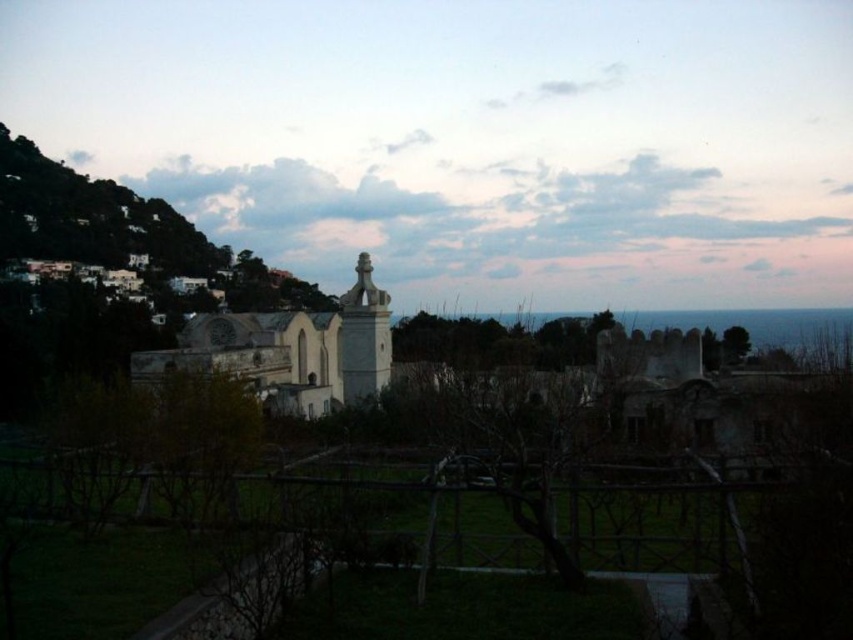
You are standing in the garden and want to take a photo of the white stone statue at center without the white stone church at center appearing in the background. Is this possible?

The white stone church at center is behind the white stone statue at center, so if you position yourself so that the statue is between you and the church, you can take a photo of the statue without the church in the background.

You are a visitor standing in the garden and want to take a photo of both the white stone statue at center and the white stone church at center. Which one should you focus on first to ensure they are both in the frame?

You should focus on the white stone statue at center first because it is much taller than the white stone church at center, so you need to adjust your camera angle to include its full height while still capturing the church in the background.

You are standing at the entrance of the garden and want to locate the white stone statue at center. According to the coordinates provided, in which direction should you walk from the entrance to reach it?

The white stone statue at center is located at coordinates point (469,138). Since the entrance is at the garden entrance, you should walk towards the center of the garden to reach it.